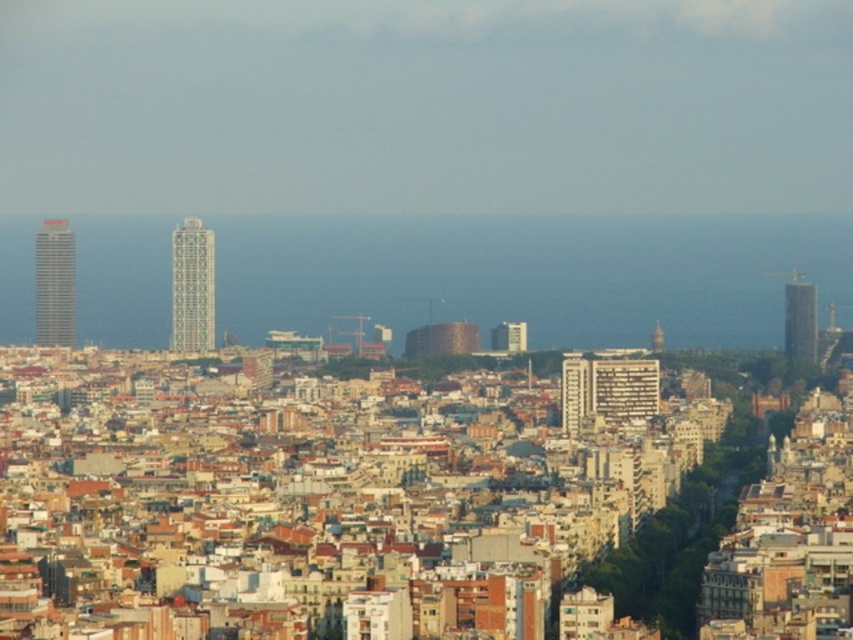
Question: Which object appears closest to the camera in this image?

Choices:
 (A) matte glass skyscraper at left
 (B) smooth glass skyscraper at center
 (C) matte white building at center

Answer: (C)

Question: Is metallic glass tower at center behind smooth glass skyscraper at center?

Choices:
 (A) yes
 (B) no

Answer: (B)

Question: Which point is farther from the camera taking this photo?

Choices:
 (A) (181, 280)
 (B) (796, 301)
 (C) (73, 237)

Answer: (B)

Question: Which object appears closest to the camera in this image?

Choices:
 (A) matte glass skyscraper at left
 (B) metallic glass tower at center

Answer: (B)

Question: Observing the image, what is the correct spatial positioning of matte glass skyscraper at left in reference to matte white building at center?

Choices:
 (A) above
 (B) below

Answer: (A)

Question: Does matte glass skyscraper at left appear on the right side of matte white building at center?

Choices:
 (A) no
 (B) yes

Answer: (A)